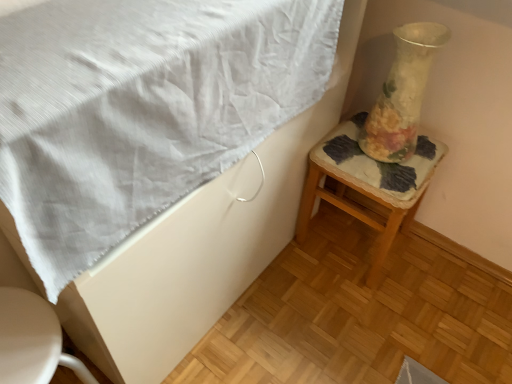
Identify the location of free point in front of wooden stool with floral cushion at right. (362, 317).